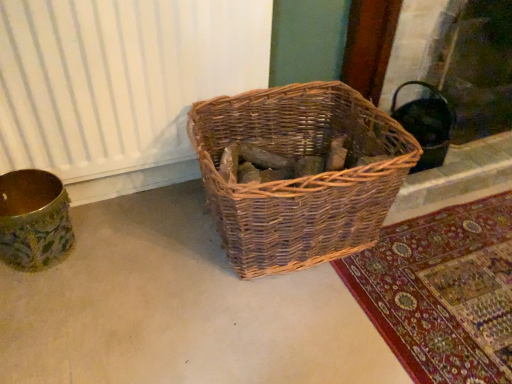
Find the location of `vacant area that lies in front of gold textured vase at left`. vacant area that lies in front of gold textured vase at left is located at coordinates (38, 302).